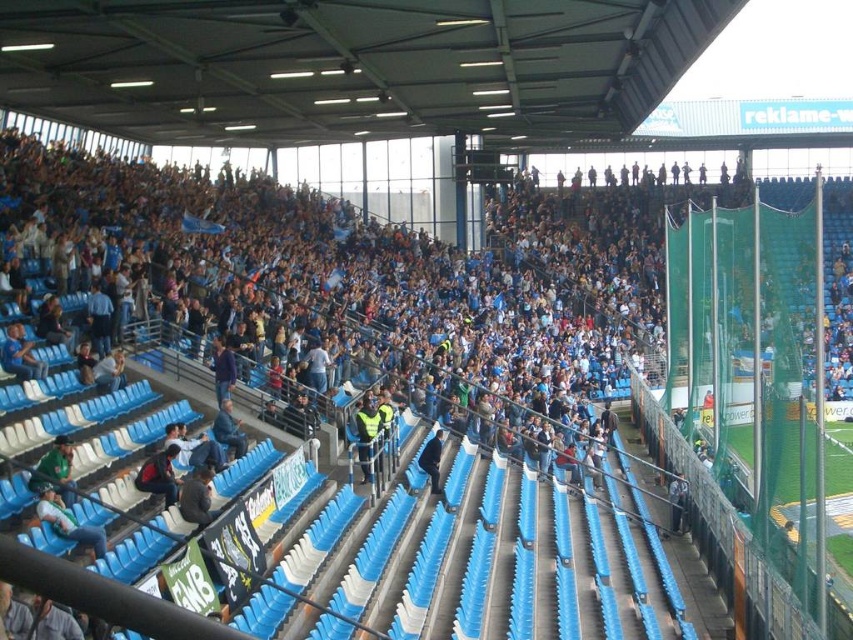
Is point (22, 332) farther from camera compared to point (120, 355)?

No, it is not.

Between point (20, 348) and point (120, 385), which one is positioned in front?

Positioned in front is point (20, 348).

Does point (4, 353) come closer to viewer compared to point (119, 355)?

Yes, it is.

Locate an element on the screen. This screenshot has width=853, height=640. blue fabric jacket at lower left is located at coordinates (20, 355).

Locate an element on the screen. light blue plastic seat at lower left is located at coordinates (68, 522).

Can you confirm if light blue plastic seat at lower left is taller than blue fabric jacket at lower left?

Incorrect, light blue plastic seat at lower left's height is not larger of blue fabric jacket at lower left's.

Is point (97, 541) farther from camera compared to point (20, 364)?

No, it is not.

In order to click on light blue plastic seat at lower left in this screenshot , I will do `click(68, 522)`.

In the scene shown: Which is more to the right, light blue plastic seat at lower left or blue fabric jacket at center?

From the viewer's perspective, blue fabric jacket at center appears more on the right side.

This screenshot has width=853, height=640. Describe the element at coordinates (68, 522) in the screenshot. I see `light blue plastic seat at lower left` at that location.

Locate an element on the screen. The width and height of the screenshot is (853, 640). light blue plastic seat at lower left is located at coordinates (68, 522).